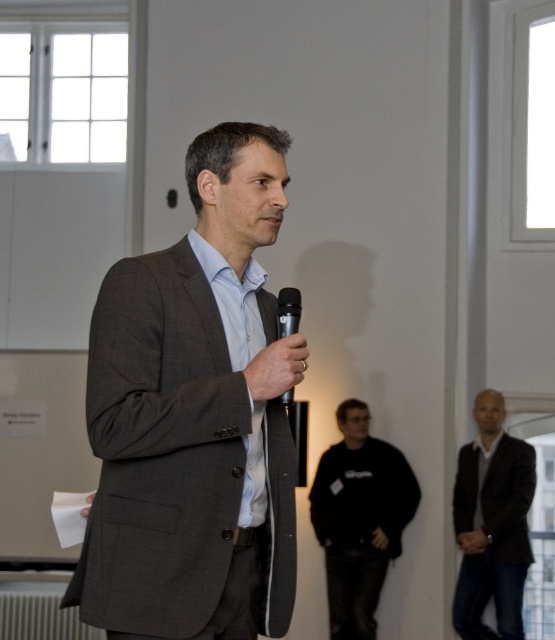
Question: Is dark brown leather jacket at lower right above black metallic microphone at center?

Choices:
 (A) no
 (B) yes

Answer: (A)

Question: Estimate the real-world distances between objects in this image. Which object is closer to the black matte sweatshirt at center?

Choices:
 (A) dark brown leather jacket at lower right
 (B) black metallic microphone at center
 (C) dark gray suit at center

Answer: (A)

Question: Does black matte sweatshirt at center appear over black metallic microphone at center?

Choices:
 (A) yes
 (B) no

Answer: (B)

Question: Which of the following is the farthest from the observer?

Choices:
 (A) dark gray suit at center
 (B) dark brown leather jacket at lower right

Answer: (B)

Question: Does black matte sweatshirt at center appear on the left side of black metallic microphone at center?

Choices:
 (A) no
 (B) yes

Answer: (A)

Question: Which object is positioned farthest from the black metallic microphone at center?

Choices:
 (A) black matte sweatshirt at center
 (B) dark brown leather jacket at lower right
 (C) dark gray suit at center

Answer: (B)